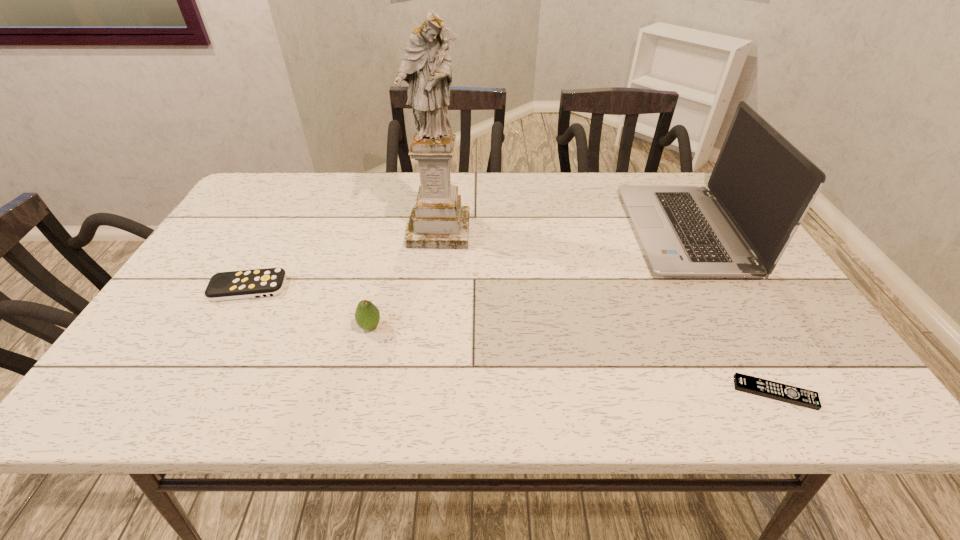
The height and width of the screenshot is (540, 960). Find the location of `the tallest object`. the tallest object is located at coordinates (438, 221).

In order to click on sculpture in this screenshot , I will do `click(438, 221)`.

The height and width of the screenshot is (540, 960). I want to click on the second tallest object, so point(761,187).

The image size is (960, 540). I want to click on the third tallest object, so click(367, 315).

This screenshot has height=540, width=960. Find the location of `the second nearest object`. the second nearest object is located at coordinates (367, 315).

I want to click on the left remote control, so tap(232, 285).

At what (x,y) coordinates should I click in order to perform the action: click on the second shortest object. Please return your answer as a coordinate pair (x, y). Image resolution: width=960 pixels, height=540 pixels. Looking at the image, I should click on (232, 285).

I want to click on the shorter remote control, so click(769, 389).

Image resolution: width=960 pixels, height=540 pixels. In order to click on the shortest object in this screenshot , I will do `click(769, 389)`.

I want to click on free space located on the front-facing side of the tallest object, so click(431, 300).